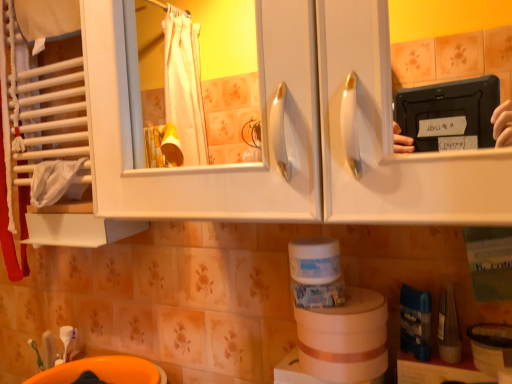
Question: Is orange plastic sink at lower left in front of or behind white matte container at center, the 1th toilet paper viewed from the top, in the image?

Choices:
 (A) behind
 (B) front

Answer: (A)

Question: Is orange plastic sink at lower left wider or thinner than white matte container at center, marked as the second toilet paper in a bottom-to-top arrangement?

Choices:
 (A) thin
 (B) wide

Answer: (B)

Question: Considering the real-world distances, which object is closest to the beige cardboard roll at lower center, the 2th toilet paper viewed from the top?

Choices:
 (A) wooden box at lower right
 (B) white matte container at center, the 1th toilet paper viewed from the top
 (C) orange plastic sink at lower left

Answer: (B)

Question: Estimate the real-world distances between objects in this image. Which object is farther from the white matte container at center, marked as the second toilet paper in a bottom-to-top arrangement?

Choices:
 (A) orange plastic sink at lower left
 (B) wooden box at lower right
 (C) beige cardboard roll at lower center, which is the 1th toilet paper in bottom-to-top order

Answer: (A)